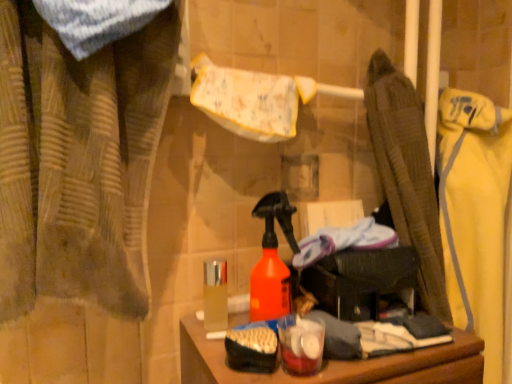
Describe the element at coordinates (78, 161) in the screenshot. This screenshot has width=512, height=384. I see `brown textured curtain at left` at that location.

What is the approximate width of yellow fabric jacket at right?

yellow fabric jacket at right is 19.24 centimeters in width.

The height and width of the screenshot is (384, 512). Find the location of `shiny metallic container at center`. shiny metallic container at center is located at coordinates (215, 295).

The image size is (512, 384). What do you see at coordinates (249, 100) in the screenshot? I see `white/yellow fabric towel at upper center` at bounding box center [249, 100].

You are a GUI agent. You are given a task and a screenshot of the screen. Output one action in this format:
    pyautogui.click(x=<x>, y=<y>)
    Task: Click on the brown textured curtain at left
    
    Given the screenshot: What is the action you would take?
    pyautogui.click(x=78, y=161)

Based on the photo, from the image's perspective, who appears lower, brown textured curtain at left or yellow fabric jacket at right?

From the image's view, yellow fabric jacket at right is below.

Is point (48, 145) closer to camera compared to point (442, 165)?

That is True.

Based on the photo, considering the sizes of brown textured curtain at left and yellow fabric jacket at right in the image, is brown textured curtain at left wider or thinner than yellow fabric jacket at right?

In the image, brown textured curtain at left appears to be more narrow than yellow fabric jacket at right.

Does brown textured curtain at left touch yellow fabric jacket at right?

No, brown textured curtain at left is not next to yellow fabric jacket at right.

Are yellow fabric jacket at right and white/yellow fabric towel at upper center beside each other?

No.

This screenshot has height=384, width=512. What are the coordinates of `bath towel above the yellow fabric jacket at right (from the image's perspective)` in the screenshot? It's located at (249, 100).

Is yellow fabric jacket at right to the left or to the right of white/yellow fabric towel at upper center in the image?

yellow fabric jacket at right is positioned on white/yellow fabric towel at upper center's right side.

Considering the relative sizes of brown textured curtain at left and shiny metallic container at center in the image provided, is brown textured curtain at left shorter than shiny metallic container at center?

No.

Can you confirm if brown textured curtain at left is thinner than shiny metallic container at center?

No.

Can we say brown textured curtain at left lies outside shiny metallic container at center?

Indeed, brown textured curtain at left is completely outside shiny metallic container at center.

In the scene shown: Is brown textured curtain at left next to shiny metallic container at center and touching it?

brown textured curtain at left and shiny metallic container at center are clearly separated.

Is yellow fabric jacket at right closer to the viewer compared to shiny metallic container at center?

That is False.

Considering the positions of objects yellow fabric jacket at right and shiny metallic container at center in the image provided, who is more to the left, yellow fabric jacket at right or shiny metallic container at center?

From the viewer's perspective, shiny metallic container at center appears more on the left side.

From their relative heights in the image, would you say yellow fabric jacket at right is taller or shorter than shiny metallic container at center?

yellow fabric jacket at right is taller than shiny metallic container at center.

From a real-world perspective, relative to shiny metallic container at center, is yellow fabric jacket at right vertically above or below?

In terms of real-world spatial position, yellow fabric jacket at right is above shiny metallic container at center.

From the image's perspective, is brown textured curtain at left below white/yellow fabric towel at upper center?

Indeed, from the image's perspective, brown textured curtain at left is shown beneath white/yellow fabric towel at upper center.

From the picture: Is white/yellow fabric towel at upper center at the back of brown textured curtain at left?

No, white/yellow fabric towel at upper center is not at the back of brown textured curtain at left.

How different are the orientations of brown textured curtain at left and white/yellow fabric towel at upper center in degrees?

There is a 0.000814-degree angle between the facing directions of brown textured curtain at left and white/yellow fabric towel at upper center.

Who is shorter, brown textured curtain at left or white/yellow fabric towel at upper center?

With less height is white/yellow fabric towel at upper center.

Is shiny metallic container at center located outside yellow fabric jacket at right?

Yes.

Identify the location of clothing above the shiny metallic container at center (from a real-world perspective). This screenshot has width=512, height=384. (475, 214).

In the scene shown: Which point is more forward, (217,266) or (477,158)?

Point (217,266)

Is shiny metallic container at center aimed at yellow fabric jacket at right?

No, shiny metallic container at center is not oriented towards yellow fabric jacket at right.

Considering the sizes of objects white/yellow fabric towel at upper center and shiny metallic container at center in the image provided, who is shorter, white/yellow fabric towel at upper center or shiny metallic container at center?

With less height is shiny metallic container at center.

Considering the sizes of white/yellow fabric towel at upper center and shiny metallic container at center in the image, is white/yellow fabric towel at upper center wider or thinner than shiny metallic container at center?

Clearly, white/yellow fabric towel at upper center has more width compared to shiny metallic container at center.

From the image's perspective, does white/yellow fabric towel at upper center appear lower than shiny metallic container at center?

No.

The height and width of the screenshot is (384, 512). In order to click on toiletry located on the left of white/yellow fabric towel at upper center in this screenshot , I will do `click(215, 295)`.

The image size is (512, 384). What are the coordinates of `curtain that appears in front of the yellow fabric jacket at right` in the screenshot? It's located at (78, 161).

Where is `clothing that is on the right side of white/yellow fabric towel at upper center`? The image size is (512, 384). clothing that is on the right side of white/yellow fabric towel at upper center is located at coordinates (475, 214).

Based on their spatial positions, is brown textured curtain at left or white/yellow fabric towel at upper center further from shiny metallic container at center?

brown textured curtain at left lies further to shiny metallic container at center than the other object.

When comparing their distances from brown textured curtain at left, does yellow fabric jacket at right or shiny metallic container at center seem closer?

shiny metallic container at center.

Looking at the image, which one is located further to yellow fabric jacket at right, brown textured curtain at left or white/yellow fabric towel at upper center?

Based on the image, brown textured curtain at left appears to be further to yellow fabric jacket at right.

Estimate the real-world distances between objects in this image. Which object is closer to shiny metallic container at center, white/yellow fabric towel at upper center or brown textured curtain at left?

Based on the image, white/yellow fabric towel at upper center appears to be nearer to shiny metallic container at center.

Looking at the image, which one is located closer to white/yellow fabric towel at upper center, brown textured curtain at left or yellow fabric jacket at right?

Among the two, brown textured curtain at left is located nearer to white/yellow fabric towel at upper center.

Looking at the image, which one is located further to yellow fabric jacket at right, white/yellow fabric towel at upper center or brown textured curtain at left?

brown textured curtain at left is further to yellow fabric jacket at right.

From the image, which object appears to be nearer to brown textured curtain at left, yellow fabric jacket at right or white/yellow fabric towel at upper center?

Based on the image, white/yellow fabric towel at upper center appears to be nearer to brown textured curtain at left.

Which object lies further to the anchor point shiny metallic container at center, brown textured curtain at left or yellow fabric jacket at right?

Based on the image, yellow fabric jacket at right appears to be further to shiny metallic container at center.

The width and height of the screenshot is (512, 384). Find the location of `toiletry between brown textured curtain at left and yellow fabric jacket at right`. toiletry between brown textured curtain at left and yellow fabric jacket at right is located at coordinates (215, 295).

Locate an element on the screen. curtain between white/yellow fabric towel at upper center and shiny metallic container at center from top to bottom is located at coordinates (78, 161).

At what (x,y) coordinates should I click in order to perform the action: click on bath towel between shiny metallic container at center and yellow fabric jacket at right in the horizontal direction. Please return your answer as a coordinate pair (x, y). The height and width of the screenshot is (384, 512). Looking at the image, I should click on click(x=249, y=100).

The width and height of the screenshot is (512, 384). Find the location of `bath towel situated between brown textured curtain at left and yellow fabric jacket at right from left to right`. bath towel situated between brown textured curtain at left and yellow fabric jacket at right from left to right is located at coordinates (249, 100).